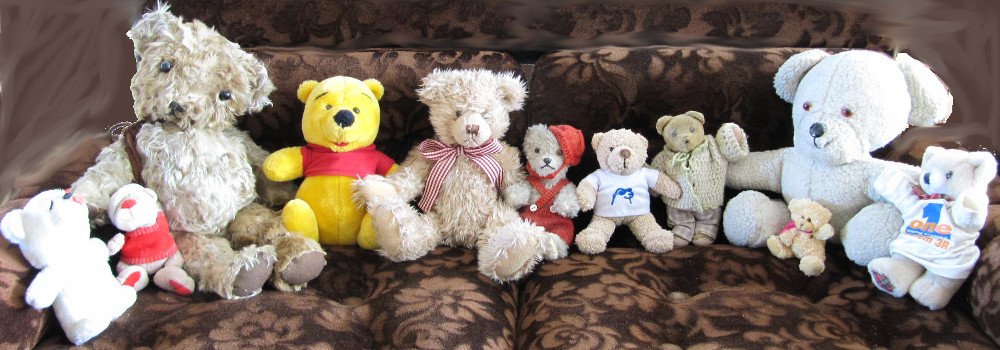
Identify the location of large stuffed bears. The width and height of the screenshot is (1000, 350). (211, 147), (341, 144), (466, 162), (834, 145).